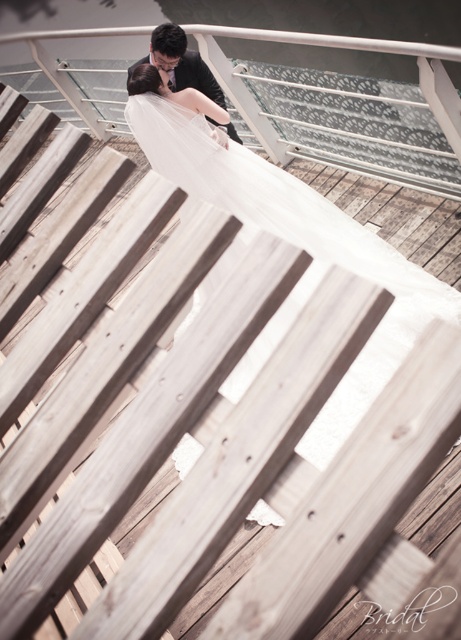
You are a photographer setting up for a couple photoshoot. The scene requires the white lace dress at upper center to be visible above the black satin suit at center. Based on the current setup, is this requirement met?

The white lace dress at upper center is positioned under the black satin suit at center, so the requirement for the white lace dress at upper center to be visible above the black satin suit at center is not met.